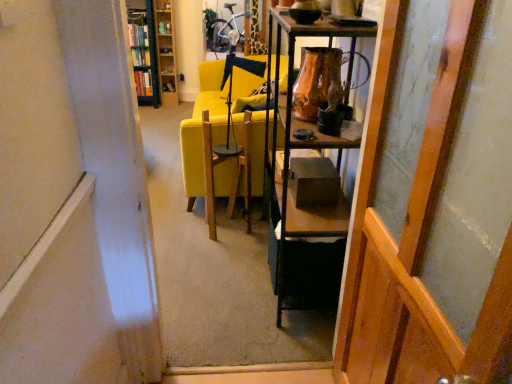
The image size is (512, 384). I want to click on vacant area that is in front of black matte box at center, so click(319, 220).